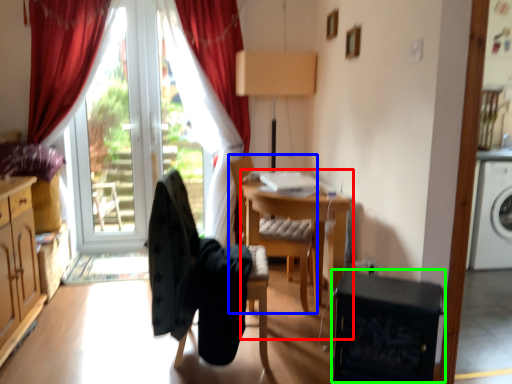
Question: Which is farther away from computer desk (highlighted by a red box)? chair (highlighted by a blue box) or dish washer (highlighted by a green box)?

Choices:
 (A) chair
 (B) dish washer

Answer: (B)